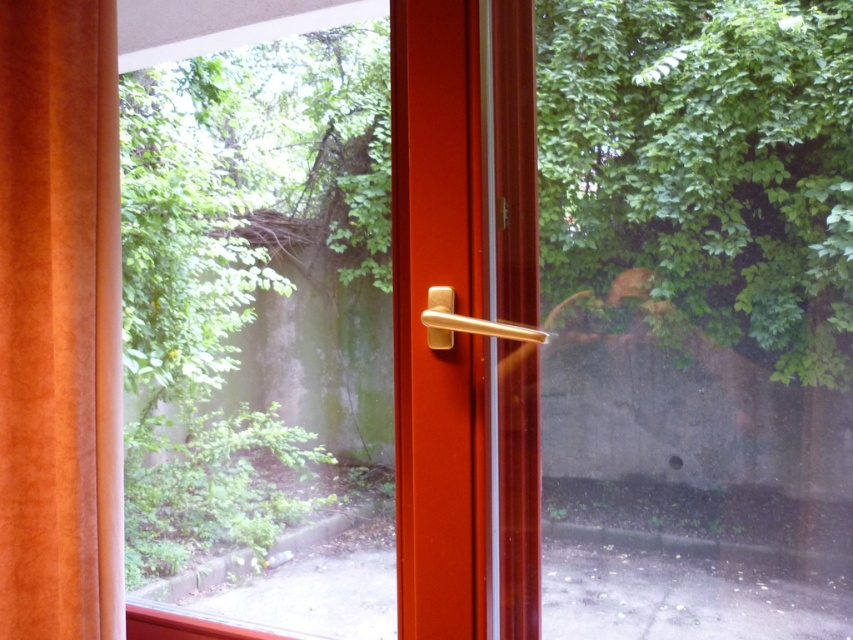
Question: From the image, what is the correct spatial relationship of suede orange curtain at left in relation to gold metallic door handle at center?

Choices:
 (A) below
 (B) above

Answer: (B)

Question: Which object is positioned farthest from the suede orange curtain at left?

Choices:
 (A) gold metallic door handle at center
 (B) matte gold handle at center

Answer: (A)

Question: Among these objects, which one is farthest from the camera?

Choices:
 (A) matte gold handle at center
 (B) suede orange curtain at left
 (C) gold metallic door handle at center

Answer: (B)

Question: Is matte gold handle at center positioned at the back of gold metallic door handle at center?

Choices:
 (A) no
 (B) yes

Answer: (B)

Question: Does matte gold handle at center have a greater width compared to gold metallic door handle at center?

Choices:
 (A) no
 (B) yes

Answer: (B)

Question: Which point is farther from the camera taking this photo?

Choices:
 (A) (9, 8)
 (B) (421, 394)

Answer: (A)